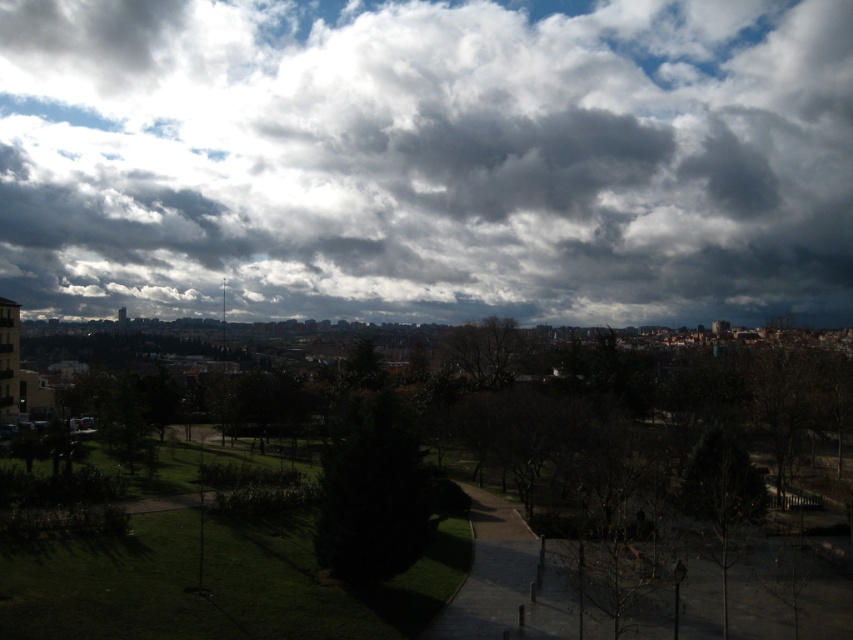
This screenshot has height=640, width=853. I want to click on cloudy sky at upper center, so click(x=428, y=160).

Is cloudy sky at upper center positioned before green leafy tree at center?

No, cloudy sky at upper center is further to the viewer.

The height and width of the screenshot is (640, 853). Find the location of `cloudy sky at upper center`. cloudy sky at upper center is located at coordinates point(428,160).

The image size is (853, 640). What do you see at coordinates (567, 452) in the screenshot?
I see `green leafy tree at center` at bounding box center [567, 452].

Find the location of a particular element. The image size is (853, 640). green leafy tree at center is located at coordinates (567, 452).